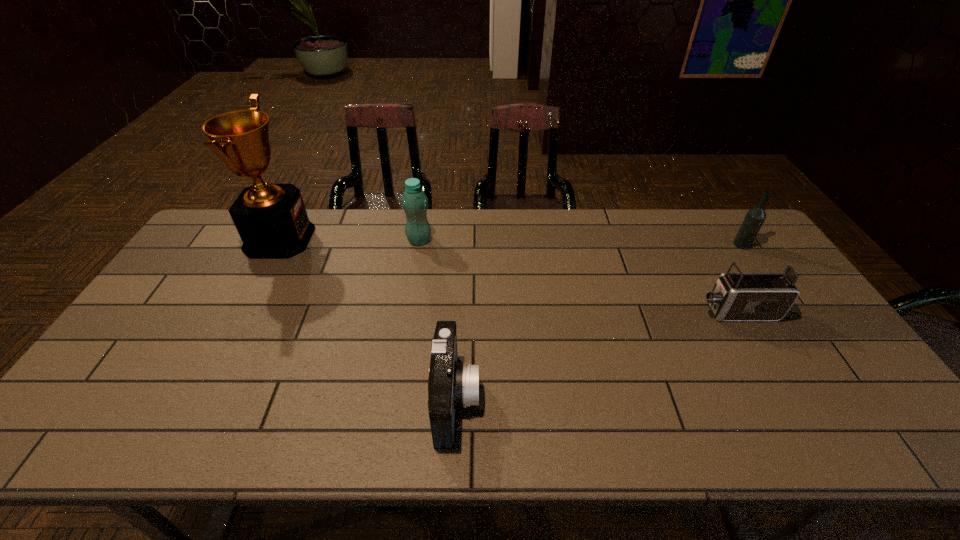
This screenshot has width=960, height=540. I want to click on free space between the third object from right to left and the water bottle, so click(438, 320).

Find the location of a particular element. This screenshot has width=960, height=540. empty space that is in between the third object from right to left and the rightmost object is located at coordinates (x=599, y=322).

The height and width of the screenshot is (540, 960). Identify the location of free space between the vodka and the fourth object from right to left. (581, 242).

Locate an element on the screen. Image resolution: width=960 pixels, height=540 pixels. blank region between the fourth object from right to left and the farther camcorder is located at coordinates (578, 276).

This screenshot has height=540, width=960. I want to click on vacant space that is in between the nearer camcorder and the leftmost object, so click(x=368, y=319).

Find the location of `empty space between the farther camcorder and the water bottle`. empty space between the farther camcorder and the water bottle is located at coordinates (578, 276).

Where is `free spot between the vodka and the nearest object`? free spot between the vodka and the nearest object is located at coordinates [599, 322].

Locate an element on the screen. This screenshot has height=540, width=960. object that stands as the second closest to the trophy cup is located at coordinates (451, 384).

Identify which object is the second closest to the water bottle. Please provide its 2D coordinates. Your answer should be formatted as a tuple, i.e. [(x, y)], where the tuple contains the x and y coordinates of a point satisfying the conditions above.

[(451, 384)]

Where is `free point that satisfies the following two spatial constraints: 1. on the front of the vodka with the label; 2. on the left side of the trophy cup`? The width and height of the screenshot is (960, 540). free point that satisfies the following two spatial constraints: 1. on the front of the vodka with the label; 2. on the left side of the trophy cup is located at coordinates (276, 245).